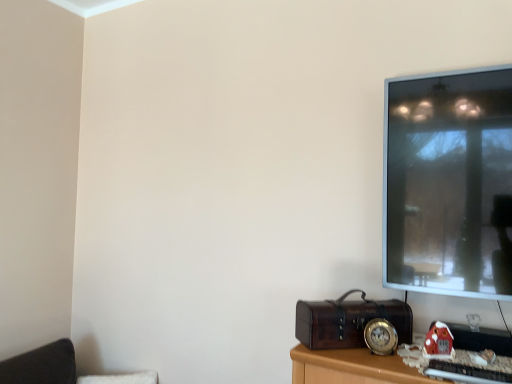
What is the approximate height of velvet black cushion at lower left?

velvet black cushion at lower left is 6.50 inches tall.

Find the location of a particular element. velvet black cushion at lower left is located at coordinates (59, 368).

What is the approximate width of velvet black cushion at lower left?

The width of velvet black cushion at lower left is 13.76 inches.

Describe the element at coordinates (59, 368) in the screenshot. I see `velvet black cushion at lower left` at that location.

Describe the element at coordinates (439, 342) in the screenshot. I see `matte plastic toy house at lower right` at that location.

Where is `matte plastic toy house at lower right`? This screenshot has height=384, width=512. matte plastic toy house at lower right is located at coordinates (439, 342).

At what (x,y) coordinates should I click in order to perform the action: click on velvet black cushion at lower left. Please return your answer as a coordinate pair (x, y). The height and width of the screenshot is (384, 512). Looking at the image, I should click on (59, 368).

Which is more to the left, velvet black cushion at lower left or matte plastic toy house at lower right?

velvet black cushion at lower left is more to the left.

Is the position of velvet black cushion at lower left less distant than that of matte plastic toy house at lower right?

That is False.

Which point is more forward, (9, 382) or (445, 326)?

The point (445, 326) is closer to the camera.

From the image's perspective, is velvet black cushion at lower left on matte plastic toy house at lower right?

No.

Based on the photo, from a real-world perspective, is velvet black cushion at lower left positioned above or below matte plastic toy house at lower right?

From a real-world perspective, velvet black cushion at lower left is physically below matte plastic toy house at lower right.

Is velvet black cushion at lower left wider or thinner than matte plastic toy house at lower right?

In the image, velvet black cushion at lower left appears to be wider than matte plastic toy house at lower right.

From their relative heights in the image, would you say velvet black cushion at lower left is taller or shorter than matte plastic toy house at lower right?

velvet black cushion at lower left is taller than matte plastic toy house at lower right.

Can you confirm if velvet black cushion at lower left is bigger than matte plastic toy house at lower right?

Yes.

Is matte plastic toy house at lower right completely or partially inside velvet black cushion at lower left?

No, matte plastic toy house at lower right is located outside of velvet black cushion at lower left.

Are velvet black cushion at lower left and matte plastic toy house at lower right making contact?

No, velvet black cushion at lower left is not touching matte plastic toy house at lower right.

Could you tell me if velvet black cushion at lower left is facing matte plastic toy house at lower right?

No, velvet black cushion at lower left is not aimed at matte plastic toy house at lower right.

How many degrees apart are the facing directions of velvet black cushion at lower left and matte plastic toy house at lower right?

4.44 degrees separate the facing orientations of velvet black cushion at lower left and matte plastic toy house at lower right.

The width and height of the screenshot is (512, 384). Find the location of `furniture below the matte plastic toy house at lower right (from a real-world perspective)`. furniture below the matte plastic toy house at lower right (from a real-world perspective) is located at coordinates (59, 368).

Which object is positioned more to the left, matte plastic toy house at lower right or velvet black cushion at lower left?

velvet black cushion at lower left is more to the left.

Which object is further away from the camera taking this photo, matte plastic toy house at lower right or velvet black cushion at lower left?

Positioned behind is velvet black cushion at lower left.

Is point (441, 323) closer or farther from the camera than point (115, 380)?

Clearly, point (441, 323) is closer to the camera than point (115, 380).

Consider the image. From the image's perspective, which object appears higher, matte plastic toy house at lower right or velvet black cushion at lower left?

matte plastic toy house at lower right, from the image's perspective.

From a real-world perspective, which object stands above the other?

matte plastic toy house at lower right.

Does matte plastic toy house at lower right have a greater width compared to velvet black cushion at lower left?

In fact, matte plastic toy house at lower right might be narrower than velvet black cushion at lower left.

Between matte plastic toy house at lower right and velvet black cushion at lower left, which one has less height?

matte plastic toy house at lower right is shorter.

Is matte plastic toy house at lower right bigger or smaller than velvet black cushion at lower left?

matte plastic toy house at lower right is smaller than velvet black cushion at lower left.

Is matte plastic toy house at lower right positioned beyond the bounds of velvet black cushion at lower left?

matte plastic toy house at lower right lies outside velvet black cushion at lower left's area.

Is matte plastic toy house at lower right not near velvet black cushion at lower left?

matte plastic toy house at lower right is positioned a significant distance from velvet black cushion at lower left.

Based on the photo, is matte plastic toy house at lower right looking in the opposite direction of velvet black cushion at lower left?

No, velvet black cushion at lower left is not at the back of matte plastic toy house at lower right.

What's the angular difference between matte plastic toy house at lower right and velvet black cushion at lower left's facing directions?

The angle between the facing direction of matte plastic toy house at lower right and the facing direction of velvet black cushion at lower left is 4.44 degrees.

You are a GUI agent. You are given a task and a screenshot of the screen. Output one action in this format:
    pyautogui.click(x=<x>, y=<y>)
    Task: Click on the furniture behind the matte plastic toy house at lower right
    This screenshot has width=512, height=384.
    Given the screenshot: What is the action you would take?
    pyautogui.click(x=59, y=368)

Locate an element on the screen. Image resolution: width=512 pixels, height=384 pixels. toy that is above the velvet black cushion at lower left (from a real-world perspective) is located at coordinates (439, 342).

The width and height of the screenshot is (512, 384). I want to click on furniture below the matte plastic toy house at lower right (from the image's perspective), so click(x=59, y=368).